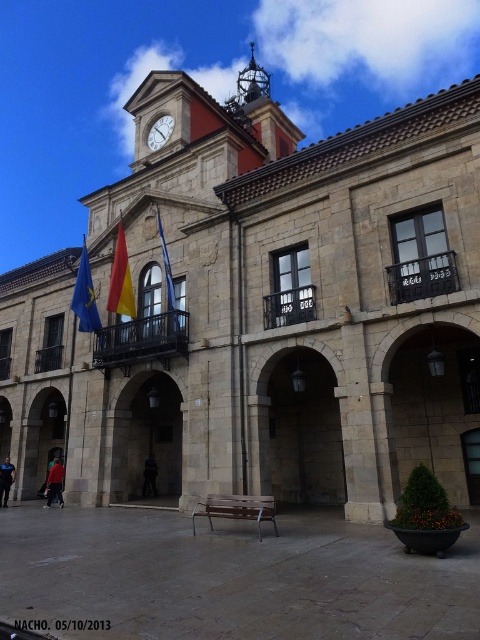
From the picture: Who is more forward, [95,550] or [264,83]?

Point [95,550]

Between brown wooden bench at center and polished brass bell tower at upper center, which one is positioned lower?

brown wooden bench at center is lower down.

Who is more forward, (414, 595) or (264, 74)?

Point (414, 595) is in front.

Locate an element on the screen. This screenshot has width=480, height=640. brown wooden bench at center is located at coordinates (231, 577).

Find the location of a particular element. Image resolution: width=480 pixels, height=640 pixels. matte stone clock at upper center is located at coordinates (159, 131).

Which is in front, point (166, 125) or point (167, 284)?

Point (167, 284) is in front.

Does point (156, 138) come in front of point (177, 321)?

No, (156, 138) is further to viewer.

Find the location of a particular element. Image resolution: width=480 pixels, height=640 pixels. matte stone clock at upper center is located at coordinates (159, 131).

Is point (223, 508) positioned before point (158, 118)?

Yes, point (223, 508) is closer to viewer.

Is wooden bench at center closer to camera compared to matte stone clock at upper center?

Yes, wooden bench at center is closer to the viewer.

Describe the element at coordinates (237, 509) in the screenshot. I see `wooden bench at center` at that location.

The height and width of the screenshot is (640, 480). I want to click on wooden bench at center, so click(x=237, y=509).